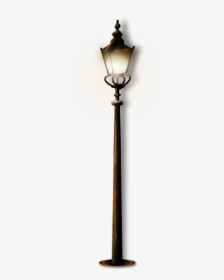
Identify the location of white light. This screenshot has height=280, width=224. (118, 65).